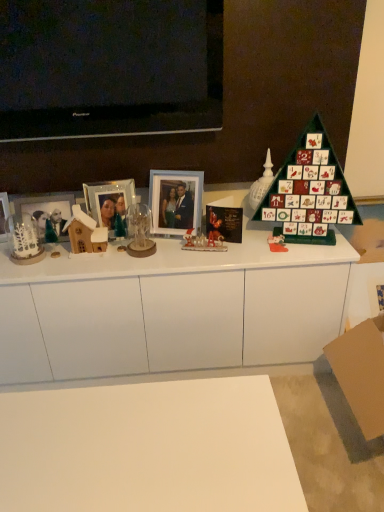
This screenshot has height=512, width=384. Identify the location of vacant area that is in front of matte plastic advent calendar at right, which appears as the first toy when viewed from the right. (281, 255).